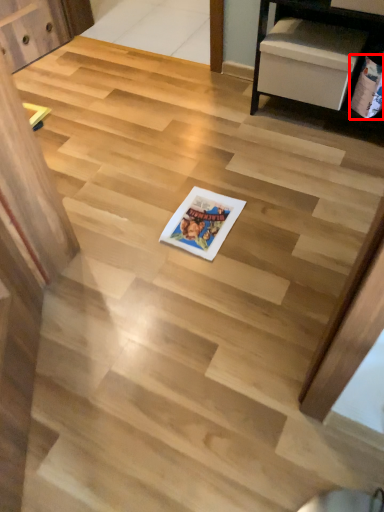
Question: From the image's perspective, considering the relative positions of comic book (annotated by the red box) and comic book in the image provided, where is comic book (annotated by the red box) located with respect to the staircase?

Choices:
 (A) below
 (B) above

Answer: (B)